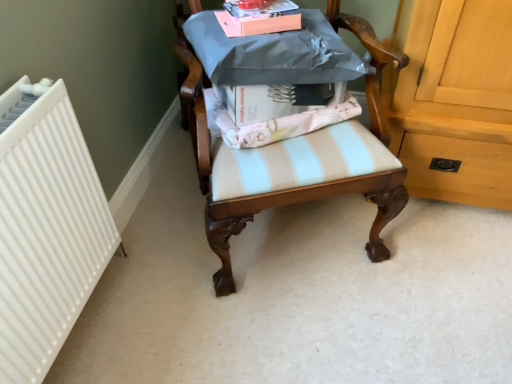
The width and height of the screenshot is (512, 384). Identify the location of free space in front of white ribbed radiator at left. (165, 298).